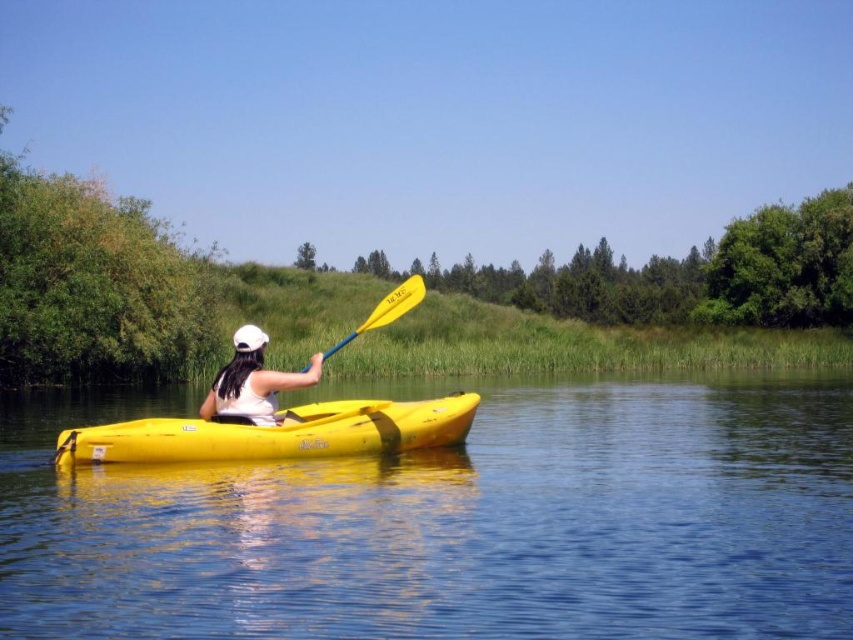
You are planning to bring both the yellow plastic kayak at center and the white matte kayak at center on a small trailer. Considering their widths, which kayak will require more space on the trailer?

The yellow plastic kayak at center requires more space on the trailer because its width surpasses that of the white matte kayak at center.

You are planning to store the yellow plastic kayak at center and the yellow plastic paddle at center in a storage locker. The locker has a maximum capacity of 2 cubic meters. If the kayak takes up 1.5 cubic meters and the paddle takes up 0.3 cubic meters, will both items fit together in the locker?

The yellow plastic kayak at center takes up 1.5 cubic meters and the yellow plastic paddle at center takes up 0.3 cubic meters. Combined, they occupy 1.8 cubic meters, which is under the 2 cubic meter limit. Both items will fit in the locker.

You are planning to store the yellow plastic kayak at center and the yellow plastic paddle at center in a vertical storage rack. Given their heights, which one might require a taller storage space?

The yellow plastic paddle at center requires a taller storage space because it has a greater height than the yellow plastic kayak at center.